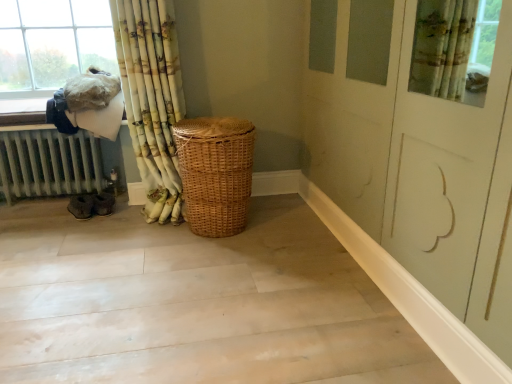
Question: Considering the relative sizes of white painted metal radiator at left and fuzzy white laundry at upper left in the image provided, is white painted metal radiator at left smaller than fuzzy white laundry at upper left?

Choices:
 (A) yes
 (B) no

Answer: (B)

Question: Would you say white painted metal radiator at left is outside fuzzy white laundry at upper left?

Choices:
 (A) yes
 (B) no

Answer: (A)

Question: Is the position of white painted metal radiator at left less distant than that of fuzzy white laundry at upper left?

Choices:
 (A) no
 (B) yes

Answer: (A)

Question: Can you confirm if white painted metal radiator at left is bigger than fuzzy white laundry at upper left?

Choices:
 (A) no
 (B) yes

Answer: (B)

Question: Is fuzzy white laundry at upper left at the back of white painted metal radiator at left?

Choices:
 (A) yes
 (B) no

Answer: (B)

Question: Considering the relative sizes of white painted metal radiator at left and fuzzy white laundry at upper left in the image provided, is white painted metal radiator at left thinner than fuzzy white laundry at upper left?

Choices:
 (A) no
 (B) yes

Answer: (A)

Question: Can you confirm if white painted metal radiator at left is positioned to the left of woven natural basket at center?

Choices:
 (A) no
 (B) yes

Answer: (B)

Question: Is white painted metal radiator at left outside of woven natural basket at center?

Choices:
 (A) yes
 (B) no

Answer: (A)

Question: From the image's perspective, is white painted metal radiator at left beneath woven natural basket at center?

Choices:
 (A) no
 (B) yes

Answer: (A)

Question: Considering the relative sizes of white painted metal radiator at left and woven natural basket at center in the image provided, is white painted metal radiator at left wider than woven natural basket at center?

Choices:
 (A) no
 (B) yes

Answer: (B)

Question: Is white painted metal radiator at left looking in the opposite direction of woven natural basket at center?

Choices:
 (A) no
 (B) yes

Answer: (A)

Question: Is white painted metal radiator at left positioned in front of woven natural basket at center?

Choices:
 (A) yes
 (B) no

Answer: (B)

Question: From a real-world perspective, does fuzzy white laundry at upper left sit lower than white painted metal radiator at left?

Choices:
 (A) no
 (B) yes

Answer: (A)